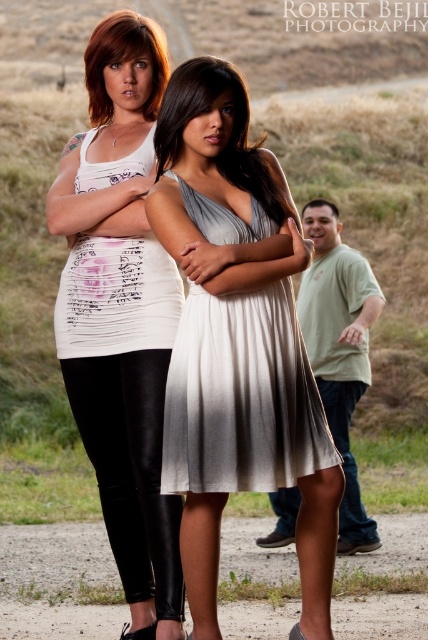
Question: Which object is the farthest from the green cotton shirt at center?

Choices:
 (A) silky beige dress at center
 (B) satin dress arm at center
 (C) shiny brown hair at upper left
 (D) satin dress at center

Answer: (D)

Question: Which object appears closest to the camera in this image?

Choices:
 (A) white matte tank top at upper left
 (B) satin dress at center
 (C) satin dress arm at center

Answer: (C)

Question: Is white matte tank top at center smaller than green matte shirt at right?

Choices:
 (A) no
 (B) yes

Answer: (A)

Question: Considering the real-world distances, which object is closest to the green cotton shirt at center?

Choices:
 (A) shiny brown hair at upper left
 (B) silky beige dress at center

Answer: (B)

Question: Is white pleated dress at center closer to the viewer compared to satin dress arm at center?

Choices:
 (A) yes
 (B) no

Answer: (B)

Question: Can you confirm if satin dress at center is positioned below satin dress arm at center?

Choices:
 (A) yes
 (B) no

Answer: (B)